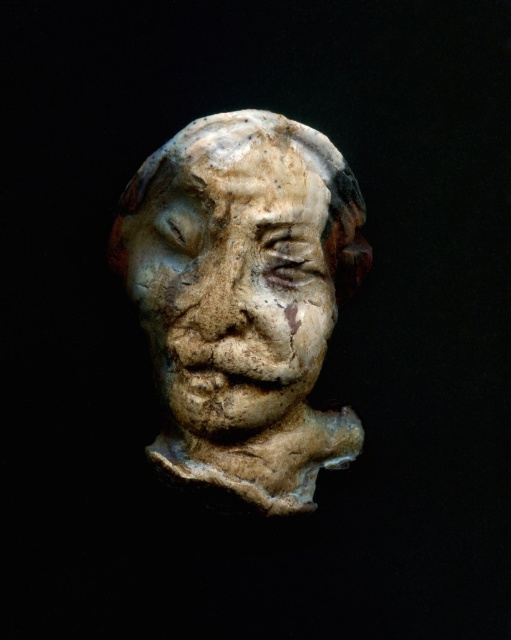
You are an art conservator examining a sculpture. You need to place a protective cover over the white clay head at center. Where should you position the cover to ensure it is centered over the sculpture?

The white clay head at center is located at point 2D coordinates of (243, 300), so you should position the cover centered at those coordinates to ensure proper coverage.

You are an art student examining two clay sculptures in an art gallery. You see the white clay head at center and the speckled clay face at center. From your perspective, which one is positioned more to the right?

The white clay head at center is positioned more to the right than the speckled clay face at center.

You are an art student analyzing the sculpture. You notice two parts of the sculpture labeled as the white clay head at center and the speckled clay face at center. Which part is taller?

→ The white clay head at center is taller than the speckled clay face at center according to the description.